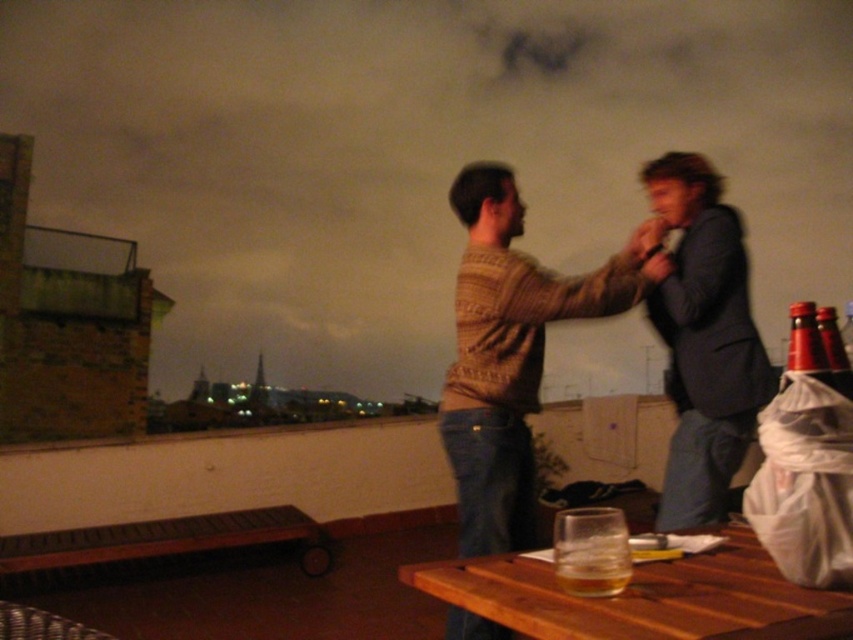
Is translucent glass at table center to the left of red glass bottle at right from the viewer's perspective?

Indeed, translucent glass at table center is positioned on the left side of red glass bottle at right.

What do you see at coordinates (592, 563) in the screenshot? The width and height of the screenshot is (853, 640). I see `translucent glass at table center` at bounding box center [592, 563].

I want to click on translucent glass at table center, so click(592, 563).

Does wooden table at lower center appear over red glass bottle at right?

No.

Between wooden table at lower center and red glass bottle at right, which one is positioned lower?

wooden table at lower center is below.

Is point (763, 554) less distant than point (822, 346)?

No, it is behind (822, 346).

Find the location of a particular element. wooden table at lower center is located at coordinates (643, 596).

Which is above, brown wooden picnic table at lower left or red glass bottle at right?

red glass bottle at right is above.

Is brown wooden picnic table at lower left below red glass bottle at right?

Correct, brown wooden picnic table at lower left is located below red glass bottle at right.

Image resolution: width=853 pixels, height=640 pixels. What are the coordinates of `brown wooden picnic table at lower left` in the screenshot? It's located at (166, 540).

The width and height of the screenshot is (853, 640). I want to click on brown wooden picnic table at lower left, so click(166, 540).